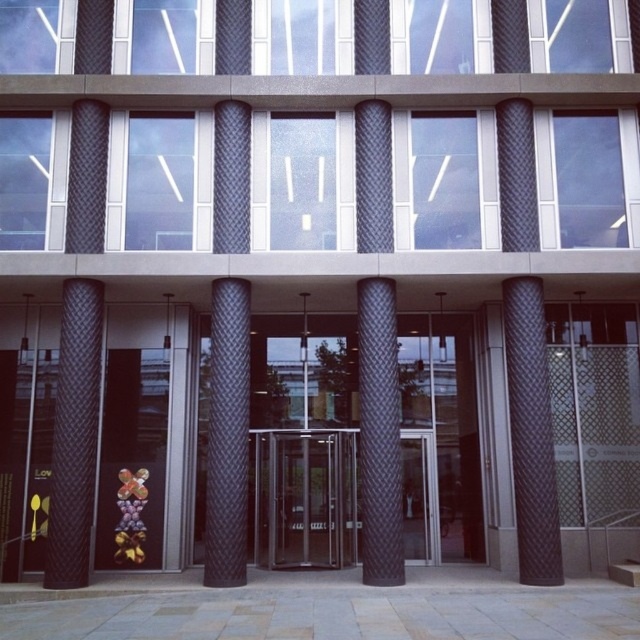
You are a visitor approaching the entrance of the modern building and notice the black quilted fabric pillar at right and the metallic gold flower at lower center. Which object do you see first as you walk towards the entrance?

The black quilted fabric pillar at right is taller than the metallic gold flower at lower center, so you would see the black quilted fabric pillar at right first as you approach the entrance.

Consider the image. You are a visitor approaching the entrance of the modern building. You see the black quilted fabric pillar at right and the metallic gold flower at lower center. Which object is positioned higher relative to the other?

The black quilted fabric pillar at right is located above the metallic gold flower at lower center, so it is positioned higher.

You are a delivery person approaching the entrance of the modern building. You need to place a package on the ground near the metallic gold flower at lower center. However, you must ensure that the package doesn not hit the black textured column at center. Given their heights, is this possible?

The black textured column at center has a greater height compared to metallic gold flower at lower center. Since the package is placed on the ground near the metallic gold flower at lower center, it won t hit the taller column as long as the package is positioned away from the column s base.